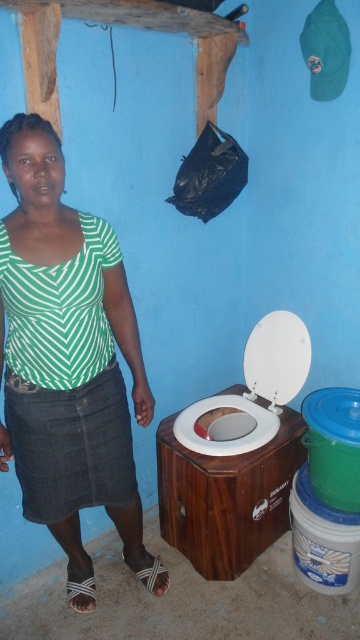
You are holding a 3.5 feet long pole and want to reach the green striped shirt at upper left from where you are standing. Can you reach it?

The distance between you and the green striped shirt at upper left is 4.32 feet, which is longer than the pole you have. Therefore, you cannot reach it with the pole.

You are standing in the bathroom and want to reach both the green striped shirt at upper left and the white plastic toilet bowl at center. Which object is closer to you?

The green striped shirt at upper left is closer to the viewer than the white plastic toilet bowl at center.

Looking at this image, you are a painter who needs to hang a picture frame that is 1.5 meters tall. You see the green striped shirt at upper left and the white plastic toilet bowl at center. Which object can the frame be placed next to without exceeding its height?

The green striped shirt at upper left is much taller than the white plastic toilet bowl at center, so the picture frame can be placed next to the green striped shirt at upper left as it can accommodate the frame height.